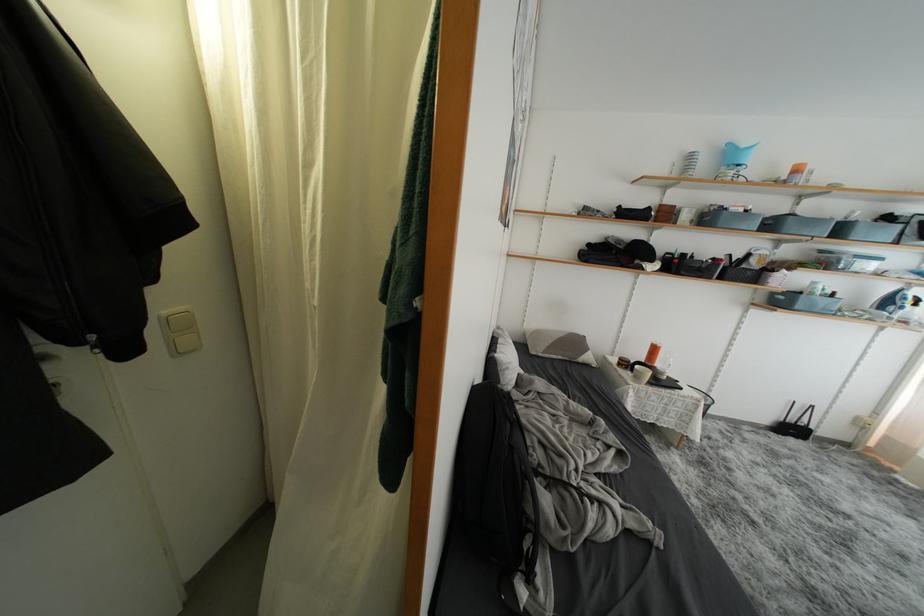
Find the location of a particular element. The image size is (924, 616). black pen holder is located at coordinates (795, 424).